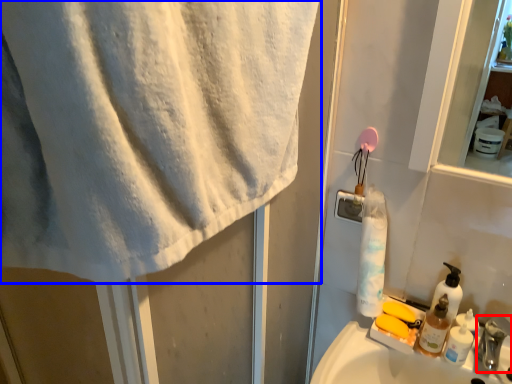
Question: Which object appears closest to the camera in this image, faucet (highlighted by a red box) or towel (highlighted by a blue box)?

Choices:
 (A) faucet
 (B) towel

Answer: (B)